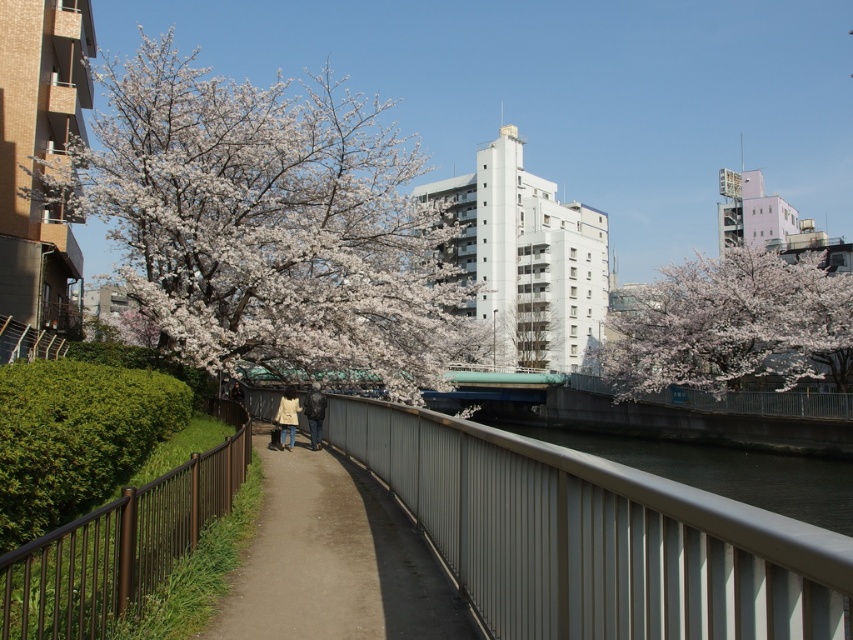
Question: Is white blossoms at upper right to the right of metallic gray waterway at center from the viewer's perspective?

Choices:
 (A) no
 (B) yes

Answer: (B)

Question: Which point is closer to the camera?

Choices:
 (A) (273, 524)
 (B) (80, 198)
 (C) (383, 442)
 (D) (219, 490)

Answer: (D)

Question: Which point is closer to the camera?

Choices:
 (A) brown metal fence at lower left
 (B) brown concrete path at center
 (C) gray metallic railing at center
 (D) white blossoms at upper right

Answer: (C)

Question: Which object appears closest to the camera in this image?

Choices:
 (A) white blossoms at upper left
 (B) metallic gray waterway at center
 (C) gray metallic railing at center

Answer: (C)

Question: Does brown concrete path at center have a smaller size compared to metallic gray waterway at center?

Choices:
 (A) no
 (B) yes

Answer: (B)

Question: Is the position of white blossoms at upper right more distant than that of brown metal fence at lower left?

Choices:
 (A) no
 (B) yes

Answer: (B)